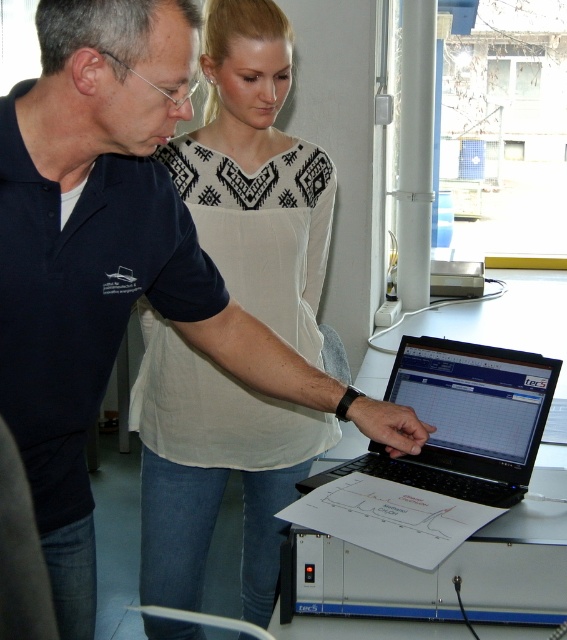
Question: Which point appears closest to the camera in this image?

Choices:
 (A) (304, 634)
 (B) (159, 426)
 (C) (431, 486)

Answer: (A)

Question: Which of the following is the closest to the observer?

Choices:
 (A) (259, 496)
 (B) (564, 483)
 (C) (281, 429)

Answer: (B)

Question: Does white fabric apron at center appear under black plastic laptop at center?

Choices:
 (A) no
 (B) yes

Answer: (B)

Question: Can you confirm if white printed blouse at upper center is thinner than white fabric apron at center?

Choices:
 (A) no
 (B) yes

Answer: (B)

Question: Which point is farther from the camera taking this photo?

Choices:
 (A) (459, 349)
 (B) (176, 365)
 (C) (249, 461)

Answer: (C)

Question: Does white printed blouse at upper center appear on the right side of black plastic laptop at center?

Choices:
 (A) yes
 (B) no

Answer: (B)